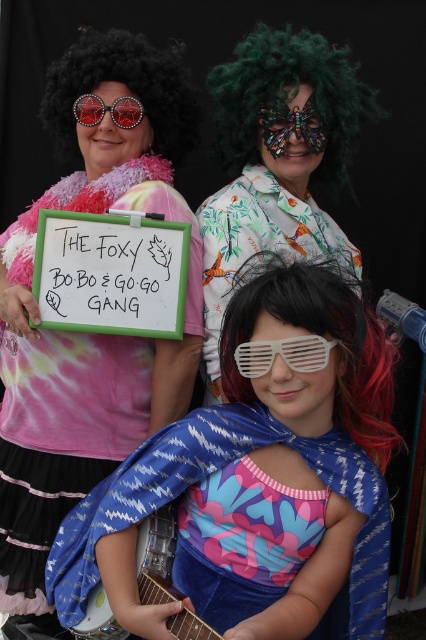
Consider the image. You are standing at the point with coordinates point (310,352) and want to walk towards the point with coordinates point (238,212). Will you be moving forward or backward?

Since point (238,212) is behind point (310,352), you will be moving backward to reach it.

You are a photographer trying to capture a perfect group photo of the three individuals in the scene. You want to place a green feather boa at upper center to frame the photo. Based on the scene description, where should you position the green feather boa to match the 2D coordinates provided?

The green feather boa at upper center should be positioned at the 2D coordinates point (276, 160) to frame the photo.